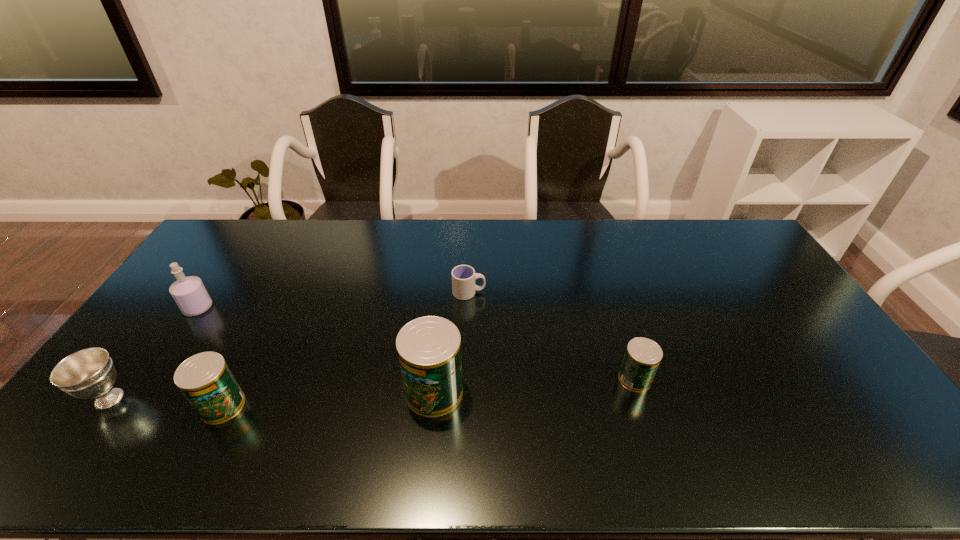
The image size is (960, 540). I want to click on vacant space that satisfies the following two spatial constraints: 1. on the back side of the rightmost can; 2. on the left side of the second can from left to right, so coord(435,379).